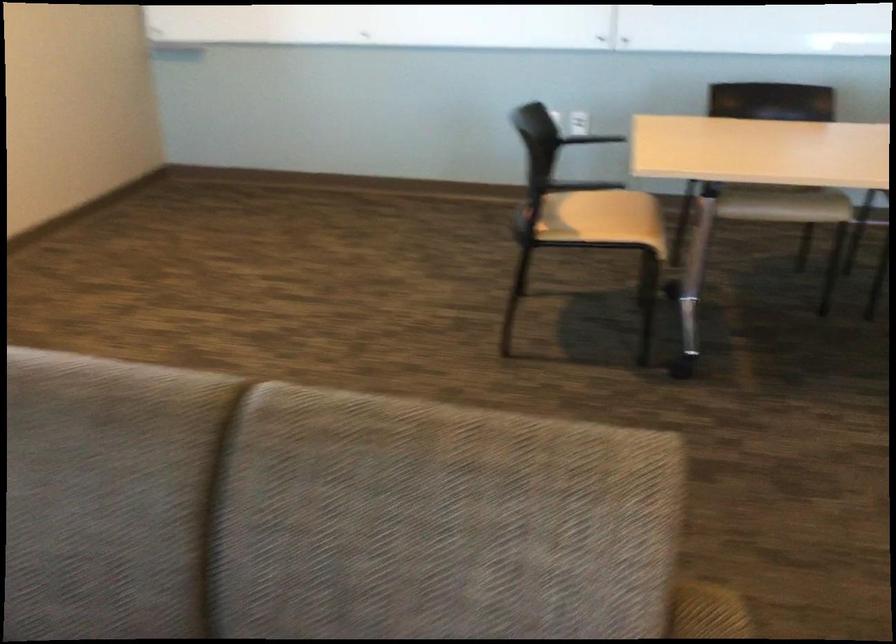
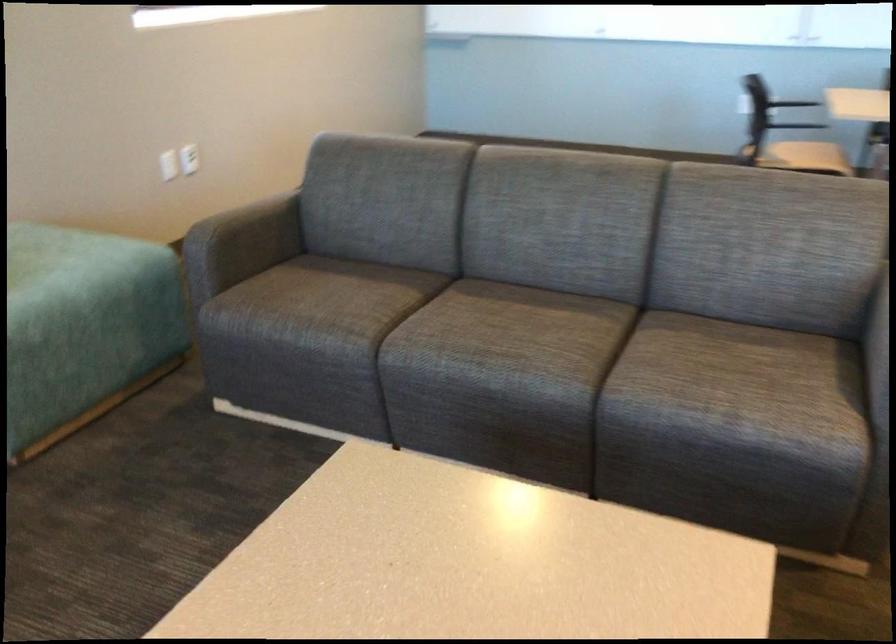
Where in the second image is the point corresponding to (x=584, y=140) from the first image?

(788, 102)